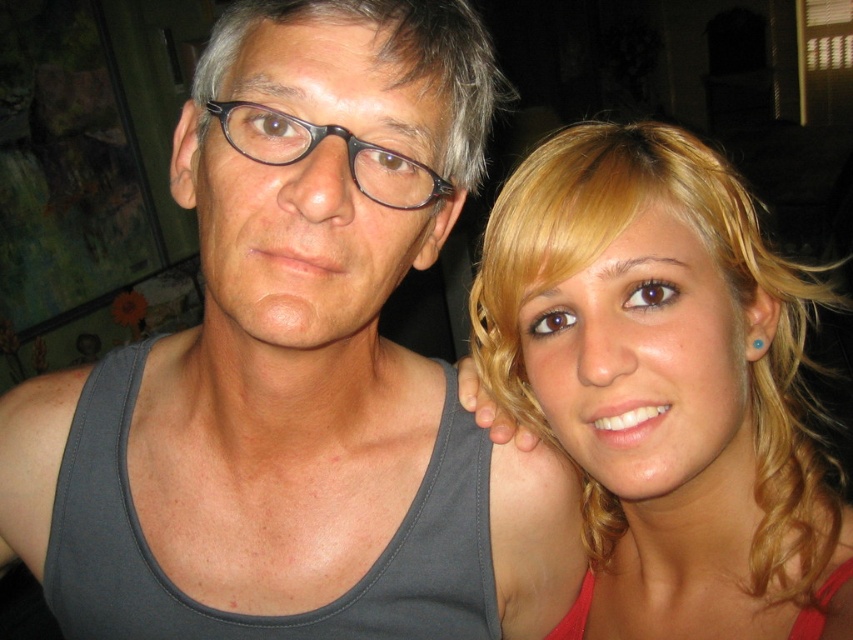
You are an interior designer who needs to place a decorative item exactly at the coordinates where the gray matte tank top at left is located. What are the coordinates for placing the item?

The coordinates for placing the decorative item are at point [299,371] where the gray matte tank top at left is located.

You are a photographer setting up a shoot. You need to position a light source to the left of the gray matte tank top at left and to the right of the blonde hair at right. Is this possible based on their current positions?

The gray matte tank top at left is already to the left of the blonde hair at right. Therefore, placing the light source to the left of the gray matte tank top at left and to the right of the blonde hair at right is not possible since the light would need to be both left of the tank top and right of the hair simultaneously, which contradicts their current positions.

Based on the scene description, can you determine if the blonde hair at right is wider than the matte black glasses at center?

The blonde hair at right might be wider than matte black glasses at center according to the description.